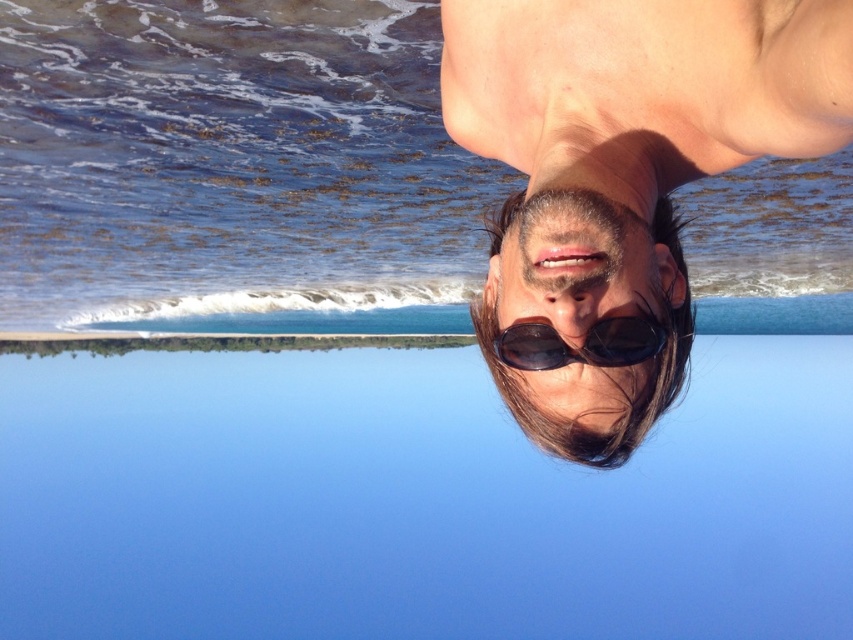
Between point (759, 246) and point (579, 356), which one is positioned in front?

Positioned in front is point (579, 356).

Does clear blue water at upper center lie in front of black reflective sunglasses at bottom?

No.

Is point (152, 209) positioned after point (498, 339)?

Yes.

Where is `clear blue water at upper center`? clear blue water at upper center is located at coordinates (233, 168).

Which is behind, point (409, 397) or point (556, 278)?

The point (409, 397) is more distant.

Can you confirm if blue water at upper center is positioned to the left of sunglasses at center?

Indeed, blue water at upper center is positioned on the left side of sunglasses at center.

I want to click on blue water at upper center, so click(x=416, y=500).

You are a GUI agent. You are given a task and a screenshot of the screen. Output one action in this format:
    pyautogui.click(x=<x>, y=<y>)
    Task: Click on the blue water at upper center
    Image resolution: width=853 pixels, height=640 pixels.
    Given the screenshot: What is the action you would take?
    pyautogui.click(x=416, y=500)

Who is higher up, clear blue water at upper center or sunglasses at center?

clear blue water at upper center is higher up.

Describe the element at coordinates (233, 168) in the screenshot. The width and height of the screenshot is (853, 640). I see `clear blue water at upper center` at that location.

You are a GUI agent. You are given a task and a screenshot of the screen. Output one action in this format:
    pyautogui.click(x=<x>, y=<y>)
    Task: Click on the clear blue water at upper center
    
    Given the screenshot: What is the action you would take?
    pyautogui.click(x=233, y=168)